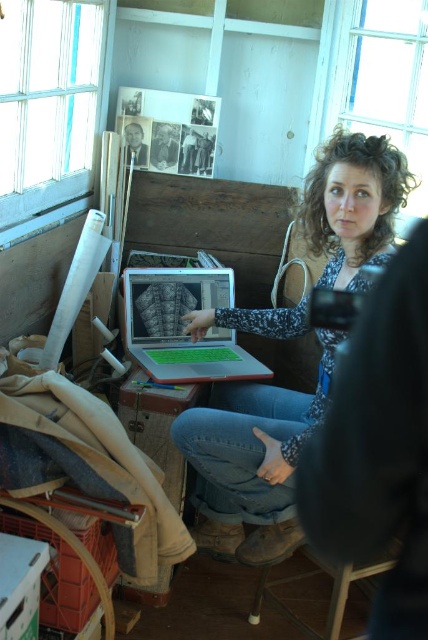
Consider the image. Which of these two, wooden stool at lower center or matte black laptop at center, stands taller?

wooden stool at lower center is taller.

Measure the distance from wooden stool at lower center to matte black laptop at center.

Result: A distance of 1.64 meters exists between wooden stool at lower center and matte black laptop at center.

The image size is (428, 640). I want to click on wooden stool at lower center, so click(336, 592).

Where is `wooden stool at lower center`? The width and height of the screenshot is (428, 640). wooden stool at lower center is located at coordinates (336, 592).

Is matte gray sweater at center bigger than wooden stool at lower center?

Indeed, matte gray sweater at center has a larger size compared to wooden stool at lower center.

Is point (341, 131) positioned in front of point (297, 625)?

Yes, point (341, 131) is in front of point (297, 625).

Which is in front, point (306, 212) or point (359, 566)?

Positioned in front is point (359, 566).

Find the location of a particular element. This screenshot has width=428, height=640. matte gray sweater at center is located at coordinates (250, 460).

From the picture: Does matte gray sweater at center have a lesser height compared to black glossy portrait at upper left?

No.

Does matte gray sweater at center have a greater height compared to black glossy portrait at upper left?

Indeed, matte gray sweater at center has a greater height compared to black glossy portrait at upper left.

Which is behind, point (392, 212) or point (136, 163)?

Positioned behind is point (136, 163).

Where is `matte gray sweater at center`? The height and width of the screenshot is (640, 428). matte gray sweater at center is located at coordinates (250, 460).